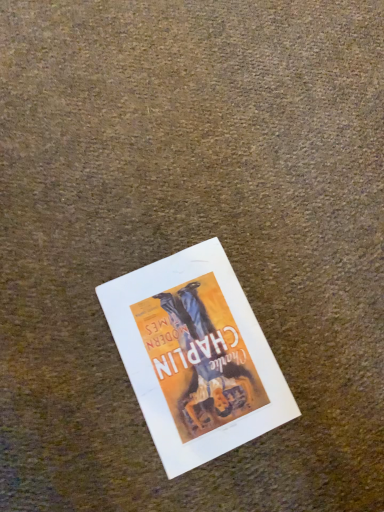
At what (x,y) coordinates should I click in order to perform the action: click on matte paper poster at center. Please return your answer as a coordinate pair (x, y). The height and width of the screenshot is (512, 384). Looking at the image, I should click on (x=195, y=356).

Describe the element at coordinates (195, 356) in the screenshot. The height and width of the screenshot is (512, 384). I see `matte paper poster at center` at that location.

The width and height of the screenshot is (384, 512). I want to click on matte paper poster at center, so click(195, 356).